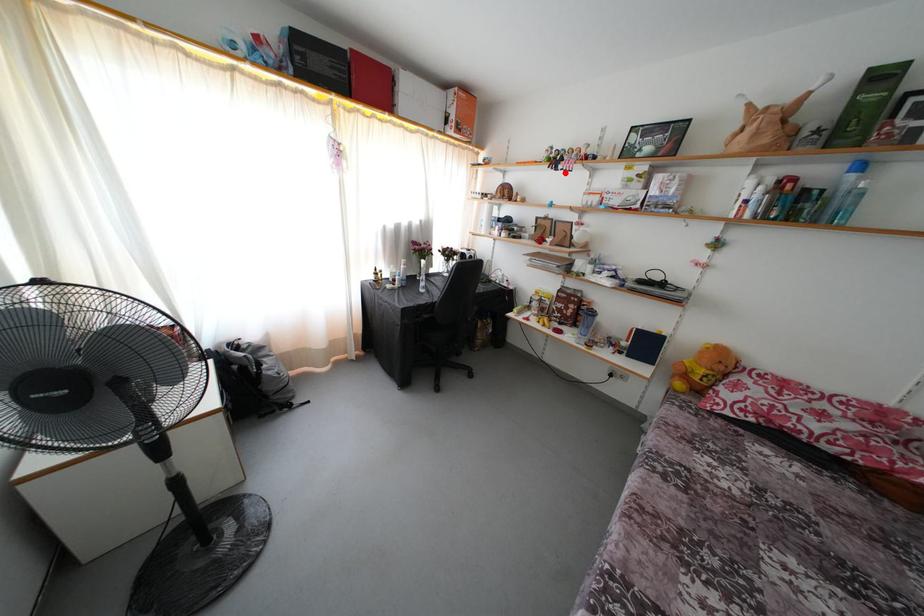
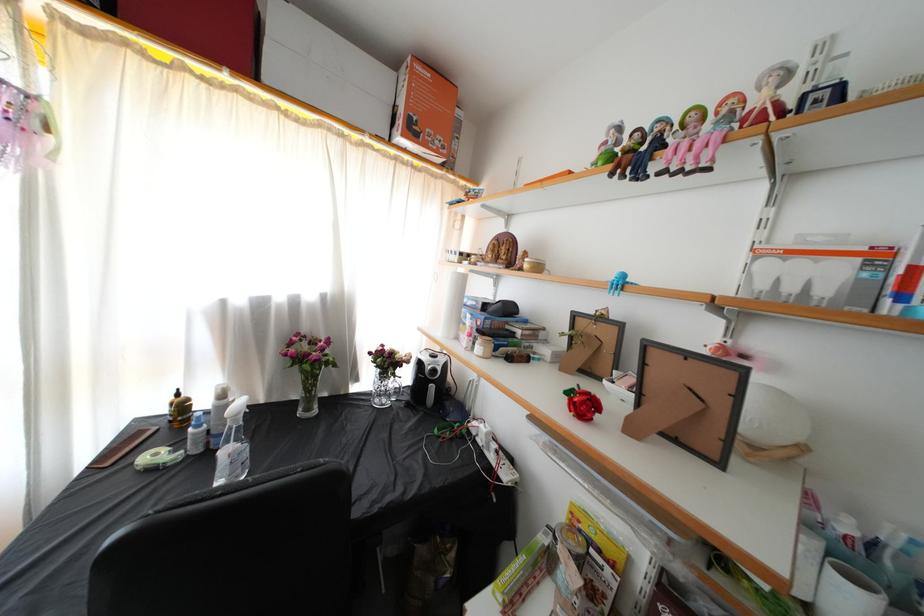
Question: I am providing you with two images of the same scene from different viewpoints. A red point is shown in image1. For the corresponding object point in image2, is it positioned nearer or farther from the camera?

Choices:
 (A) Nearer
 (B) Farther

Answer: (B)